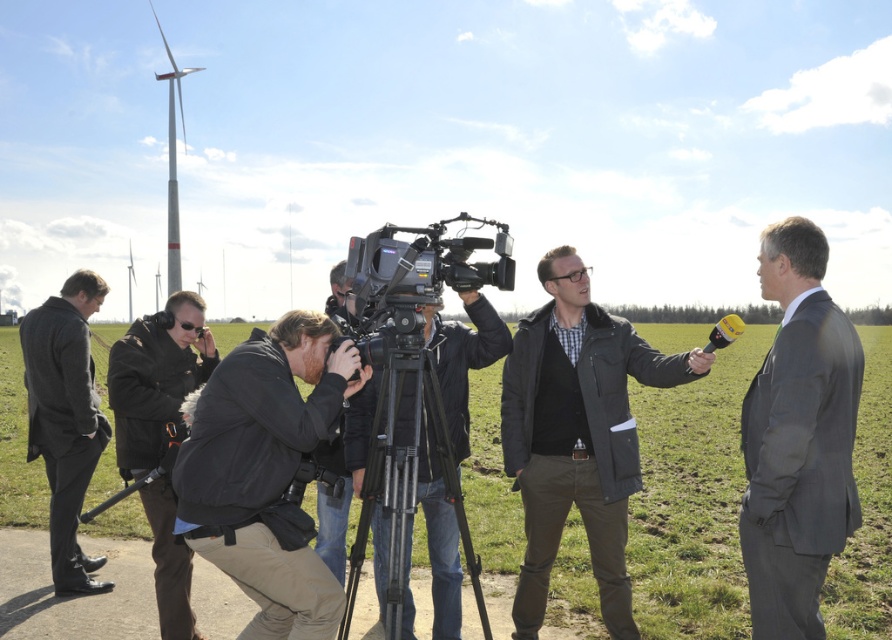
You are a camera operator who needs to set up the camera at the silver metallic tripod at center. Based on the scene description, where exactly should you place the tripod?

The silver metallic tripod at center should be placed at point (409, 502) as per the coordinates provided.

You are standing in the outdoor scene and want to take a photo of both point (593, 572) and point (459, 396). Which point should you focus on first to ensure both are in the frame?

You should focus on point (593, 572) first because it is closer to the viewer than point (459, 396), ensuring both points are within the frame.